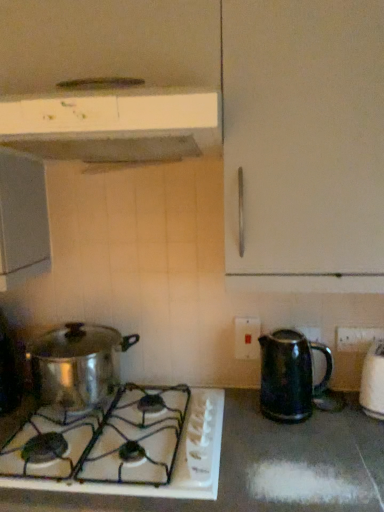
Where is `white glossy gas stove at lower left`? white glossy gas stove at lower left is located at coordinates (268, 466).

What do you see at coordinates (76, 362) in the screenshot?
I see `shiny metallic pot at lower left, which is counted as the second kitchen appliance, starting from the top` at bounding box center [76, 362].

You are a GUI agent. You are given a task and a screenshot of the screen. Output one action in this format:
    pyautogui.click(x=<x>, y=<y>)
    Task: Click on the white plastic electric outlet at center, which is counted as the first electric outlet, starting from the back
    This screenshot has height=512, width=384.
    Given the screenshot: What is the action you would take?
    pyautogui.click(x=246, y=338)

Measure the distance between point (x=136, y=130) and camera.

Point (x=136, y=130) and camera are 35.31 inches apart from each other.

The width and height of the screenshot is (384, 512). What are the coordinates of `white glossy gas stove at lower left` in the screenshot? It's located at (268, 466).

Is black plastic electric outlet at lower right, which appears as the 2th electric outlet when viewed from the back, not close to white plastic electric outlet at center, which is counted as the first electric outlet, starting from the back?

No, black plastic electric outlet at lower right, which appears as the 2th electric outlet when viewed from the back, is not far away from white plastic electric outlet at center, which is counted as the first electric outlet, starting from the back.

Who is bigger, black plastic electric outlet at lower right, the 1th electric outlet when ordered from right to left, or white plastic electric outlet at center, which is counted as the first electric outlet, starting from the back?

Bigger between the two is white plastic electric outlet at center, which is counted as the first electric outlet, starting from the back.

Is black plastic electric outlet at lower right, which appears as the 2th electric outlet when viewed from the back, wider than white plastic electric outlet at center, the 2th electric outlet when ordered from right to left?

No, black plastic electric outlet at lower right, which appears as the 2th electric outlet when viewed from the back, is not wider than white plastic electric outlet at center, the 2th electric outlet when ordered from right to left.

Is white plastic electric outlet at center, which is counted as the first electric outlet, starting from the back, inside black plastic electric outlet at lower right, which appears as the 2th electric outlet when viewed from the back?

No, white plastic electric outlet at center, which is counted as the first electric outlet, starting from the back, is not inside black plastic electric outlet at lower right, which appears as the 2th electric outlet when viewed from the back.

Is white matte range hood at upper center, the 3th kitchen appliance from the bottom, spatially inside shiny metallic kettle at right, the first kitchen appliance ordered from the bottom, or outside of it?

white matte range hood at upper center, the 3th kitchen appliance from the bottom, is outside shiny metallic kettle at right, the first kitchen appliance ordered from the bottom.

Does white matte range hood at upper center, the 1th kitchen appliance in the top-to-bottom sequence, appear on the left side of shiny metallic kettle at right, the first kitchen appliance ordered from the bottom?

Yes.

Which is in front, point (191, 106) or point (290, 353)?

The point (191, 106) is closer to the camera.

From the image's perspective, which one is positioned higher, white matte range hood at upper center, the 1th kitchen appliance in the top-to-bottom sequence, or shiny metallic kettle at right, marked as the 3th kitchen appliance in a top-to-bottom arrangement?

white matte range hood at upper center, the 1th kitchen appliance in the top-to-bottom sequence, from the image's perspective.

Locate an element on the screen. The height and width of the screenshot is (512, 384). countertop that appears below the black plastic electric outlet at lower right, which appears as the 2th electric outlet when viewed from the back (from a real-world perspective) is located at coordinates (268, 466).

Is white glossy gas stove at lower left positioned in front of black plastic electric outlet at lower right, which is counted as the 2th electric outlet, starting from the left?

Yes.

Is white glossy gas stove at lower left situated inside black plastic electric outlet at lower right, which ranks as the 1th electric outlet in front-to-back order, or outside?

white glossy gas stove at lower left is located beyond the bounds of black plastic electric outlet at lower right, which ranks as the 1th electric outlet in front-to-back order.

From a real-world perspective, is white glossy gas stove at lower left physically located above or below shiny metallic kettle at right, marked as the 3th kitchen appliance in a top-to-bottom arrangement?

Clearly, from a real-world perspective, white glossy gas stove at lower left is below shiny metallic kettle at right, marked as the 3th kitchen appliance in a top-to-bottom arrangement.

From the image's perspective, is white glossy gas stove at lower left above or below shiny metallic kettle at right, marked as the 3th kitchen appliance in a top-to-bottom arrangement?

From the image's perspective, white glossy gas stove at lower left appears below shiny metallic kettle at right, marked as the 3th kitchen appliance in a top-to-bottom arrangement.

Based on the photo, would you say white glossy gas stove at lower left is outside shiny metallic kettle at right, marked as the 3th kitchen appliance in a top-to-bottom arrangement?

Yes, white glossy gas stove at lower left is not within shiny metallic kettle at right, marked as the 3th kitchen appliance in a top-to-bottom arrangement.

Does white glossy gas stove at lower left turn towards shiny metallic kettle at right, marked as the 3th kitchen appliance in a top-to-bottom arrangement?

No, white glossy gas stove at lower left is not facing towards shiny metallic kettle at right, marked as the 3th kitchen appliance in a top-to-bottom arrangement.

Is white matte range hood at upper center, the 1th kitchen appliance in the top-to-bottom sequence, placed right next to black plastic electric outlet at lower right, the 1th electric outlet when ordered from right to left?

No, white matte range hood at upper center, the 1th kitchen appliance in the top-to-bottom sequence, is not with black plastic electric outlet at lower right, the 1th electric outlet when ordered from right to left.

Who is taller, white matte range hood at upper center, the 3th kitchen appliance from the bottom, or black plastic electric outlet at lower right, the 1th electric outlet when ordered from right to left?

Standing taller between the two is white matte range hood at upper center, the 3th kitchen appliance from the bottom.

Does white matte range hood at upper center, the 1th kitchen appliance in the top-to-bottom sequence, appear on the right side of black plastic electric outlet at lower right, which ranks as the 1th electric outlet in front-to-back order?

In fact, white matte range hood at upper center, the 1th kitchen appliance in the top-to-bottom sequence, is to the left of black plastic electric outlet at lower right, which ranks as the 1th electric outlet in front-to-back order.

Which point is more forward, (373, 334) or (46, 403)?

The point (46, 403) is closer.

Which is in front, black plastic electric outlet at lower right, the 1th electric outlet when ordered from right to left, or shiny metallic pot at lower left, which is the 2th kitchen appliance in bottom-to-top order?

shiny metallic pot at lower left, which is the 2th kitchen appliance in bottom-to-top order, is more forward.

Could you tell me if white plastic electric outlet at center, the second electric outlet positioned from the front, is facing white glossy gas stove at lower left?

No, white plastic electric outlet at center, the second electric outlet positioned from the front, is not facing towards white glossy gas stove at lower left.

From the image's perspective, is white plastic electric outlet at center, the first electric outlet viewed from the left, beneath white glossy gas stove at lower left?

No, from the image's perspective, white plastic electric outlet at center, the first electric outlet viewed from the left, is not beneath white glossy gas stove at lower left.

Is white plastic electric outlet at center, the first electric outlet viewed from the left, directly adjacent to white glossy gas stove at lower left?

No, white plastic electric outlet at center, the first electric outlet viewed from the left, is not in contact with white glossy gas stove at lower left.

In the scene shown: Which of these two, white plastic electric outlet at center, the first electric outlet viewed from the left, or white glossy gas stove at lower left, is smaller?

white plastic electric outlet at center, the first electric outlet viewed from the left, is smaller.

At what (x,y) coordinates should I click in order to perform the action: click on electric outlet below the black plastic electric outlet at lower right, which appears as the 2th electric outlet when viewed from the back (from the image's perspective). Please return your answer as a coordinate pair (x, y). Looking at the image, I should click on (246, 338).

Locate an element on the screen. kitchen appliance that is the 2nd object located behind the white matte range hood at upper center, the 1th kitchen appliance in the top-to-bottom sequence is located at coordinates (290, 375).

Based on their spatial positions, is white glossy gas stove at lower left or shiny metallic kettle at right, marked as the 3th kitchen appliance in a top-to-bottom arrangement, further from shiny metallic pot at lower left, which is the 2th kitchen appliance in bottom-to-top order?

Based on the image, shiny metallic kettle at right, marked as the 3th kitchen appliance in a top-to-bottom arrangement, appears to be further to shiny metallic pot at lower left, which is the 2th kitchen appliance in bottom-to-top order.

Consider the image. Which object lies nearer to the anchor point shiny metallic kettle at right, marked as the 3th kitchen appliance in a top-to-bottom arrangement, white plastic electric outlet at center, the first electric outlet viewed from the left, or white matte range hood at upper center, the 1th kitchen appliance in the top-to-bottom sequence?

white plastic electric outlet at center, the first electric outlet viewed from the left, lies closer to shiny metallic kettle at right, marked as the 3th kitchen appliance in a top-to-bottom arrangement, than the other object.

Which object lies further to the anchor point white plastic electric outlet at center, the second electric outlet positioned from the front, black plastic electric outlet at lower right, which appears as the 2th electric outlet when viewed from the back, or white glossy gas stove at lower left?

white glossy gas stove at lower left is positioned further to the anchor white plastic electric outlet at center, the second electric outlet positioned from the front.

Based on their spatial positions, is white matte range hood at upper center, the 3th kitchen appliance from the bottom, or shiny metallic pot at lower left, which is counted as the second kitchen appliance, starting from the top, further from black plastic electric outlet at lower right, which appears as the 2th electric outlet when viewed from the back?

Among the two, white matte range hood at upper center, the 3th kitchen appliance from the bottom, is located further to black plastic electric outlet at lower right, which appears as the 2th electric outlet when viewed from the back.

Looking at the image, which one is located closer to shiny metallic pot at lower left, which is the 2th kitchen appliance in bottom-to-top order, black plastic electric outlet at lower right, which appears as the 2th electric outlet when viewed from the back, or white matte range hood at upper center, the 1th kitchen appliance in the top-to-bottom sequence?

Based on the image, white matte range hood at upper center, the 1th kitchen appliance in the top-to-bottom sequence, appears to be nearer to shiny metallic pot at lower left, which is the 2th kitchen appliance in bottom-to-top order.

Which object lies further to the anchor point black plastic electric outlet at lower right, the 1th electric outlet when ordered from right to left, white glossy gas stove at lower left or shiny metallic kettle at right, the first kitchen appliance ordered from the bottom?

Based on the image, white glossy gas stove at lower left appears to be further to black plastic electric outlet at lower right, the 1th electric outlet when ordered from right to left.

From the image, which object appears to be nearer to shiny metallic kettle at right, the first kitchen appliance ordered from the bottom, white matte range hood at upper center, the 3th kitchen appliance from the bottom, or white plastic electric outlet at center, which is counted as the first electric outlet, starting from the back?

white plastic electric outlet at center, which is counted as the first electric outlet, starting from the back, lies closer to shiny metallic kettle at right, the first kitchen appliance ordered from the bottom, than the other object.

In the scene shown: Based on their spatial positions, is white plastic electric outlet at center, the first electric outlet viewed from the left, or white matte range hood at upper center, the 1th kitchen appliance in the top-to-bottom sequence, further from white glossy gas stove at lower left?

The object further to white glossy gas stove at lower left is white matte range hood at upper center, the 1th kitchen appliance in the top-to-bottom sequence.

This screenshot has height=512, width=384. Identify the location of kitchen appliance between white plastic electric outlet at center, which is counted as the first electric outlet, starting from the back, and black plastic electric outlet at lower right, the 1th electric outlet when ordered from right to left. click(290, 375).

Where is `electric outlet located between shiny metallic pot at lower left, which is the 2th kitchen appliance in bottom-to-top order, and shiny metallic kettle at right, the first kitchen appliance ordered from the bottom, in the left-right direction`? The width and height of the screenshot is (384, 512). electric outlet located between shiny metallic pot at lower left, which is the 2th kitchen appliance in bottom-to-top order, and shiny metallic kettle at right, the first kitchen appliance ordered from the bottom, in the left-right direction is located at coordinates (246, 338).

Identify the location of electric outlet located between white glossy gas stove at lower left and shiny metallic kettle at right, the first kitchen appliance ordered from the bottom, in the left-right direction. The image size is (384, 512). (246, 338).

Find the location of `countertop between shiny metallic pot at lower left, which is the 2th kitchen appliance in bottom-to-top order, and black plastic electric outlet at lower right, which is counted as the 2th electric outlet, starting from the left, in the horizontal direction`. countertop between shiny metallic pot at lower left, which is the 2th kitchen appliance in bottom-to-top order, and black plastic electric outlet at lower right, which is counted as the 2th electric outlet, starting from the left, in the horizontal direction is located at coordinates [x=268, y=466].